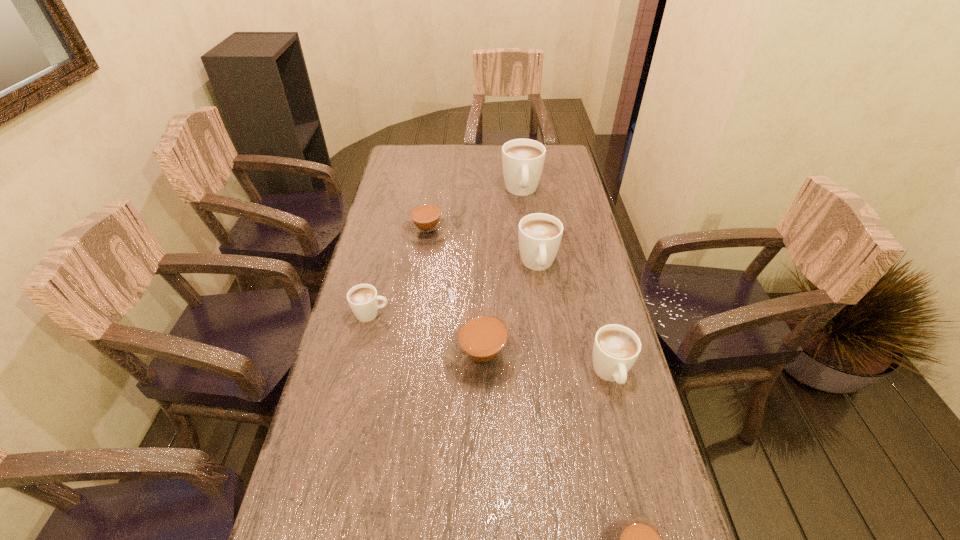
In order to click on the second nearest white cappuccino in this screenshot , I will do `click(363, 299)`.

This screenshot has height=540, width=960. Find the location of `free space located with the handle on the side of the biggest white cappuccino`. free space located with the handle on the side of the biggest white cappuccino is located at coordinates (x=525, y=219).

The height and width of the screenshot is (540, 960). Identify the location of vacant space situated with the handle on the side of the third farthest cappuccino. (554, 381).

I want to click on free region located 0.290m on the front of the second nearest brown cappuccino, so click(484, 518).

You are a GUI agent. You are given a task and a screenshot of the screen. Output one action in this format:
    pyautogui.click(x=<x>, y=<y>)
    Task: Click on the free spot located with the handle on the side of the rightmost white cappuccino
    The height and width of the screenshot is (540, 960).
    Given the screenshot: What is the action you would take?
    pyautogui.click(x=633, y=464)

Where is `free space located 0.340m on the back of the farthest brown cappuccino`? free space located 0.340m on the back of the farthest brown cappuccino is located at coordinates (436, 167).

You are a GUI agent. You are given a task and a screenshot of the screen. Output one action in this format:
    pyautogui.click(x=<x>, y=<y>)
    Task: Click on the vacant space situated 0.090m with the handle on the side of the third farthest white cappuccino
    The width and height of the screenshot is (960, 540).
    Given the screenshot: What is the action you would take?
    pyautogui.click(x=421, y=314)

In the image, there is a desktop. At what (x,y) coordinates should I click in order to perform the action: click on vacant region at the far edge. Please return your answer as a coordinate pair (x, y). Looking at the image, I should click on (439, 156).

In order to click on free spot at the left edge of the desktop in this screenshot , I will do pyautogui.click(x=326, y=529).

The width and height of the screenshot is (960, 540). What are the coordinates of `vacant region at the right edge of the desktop` in the screenshot? It's located at (578, 289).